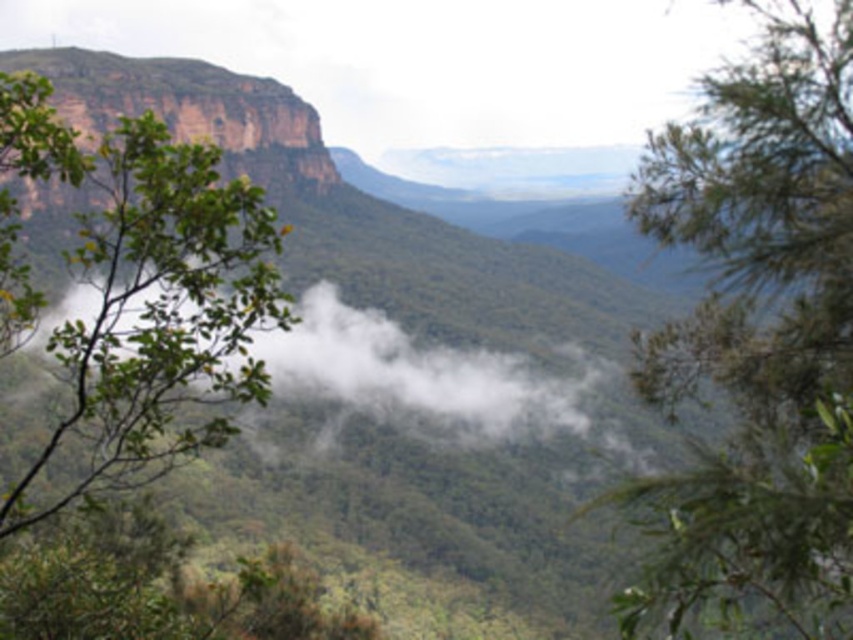
You are a hiker standing at the base of the mountain. You see a green leafy tree at upper left and a green leafy tree at left. Which tree is closer to you?

The green leafy tree at upper left is closer to you because the green leafy tree at left is behind it.